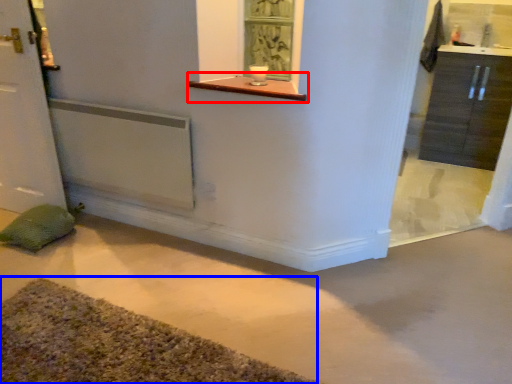
Question: Among these objects, which one is nearest to the camera, window sill (highlighted by a red box) or bath mat (highlighted by a blue box)?

Choices:
 (A) window sill
 (B) bath mat

Answer: (B)